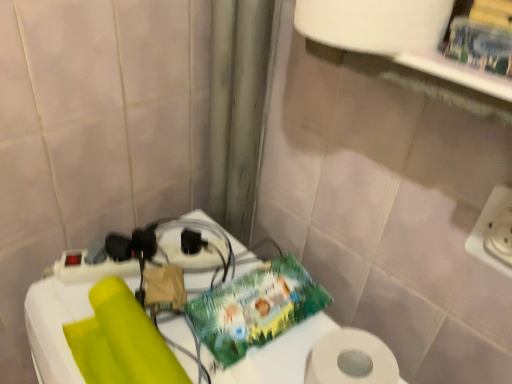
Question: Is white plastic table at lower left facing towards white plastic electric outlet at right?

Choices:
 (A) no
 (B) yes

Answer: (A)

Question: Is white plastic table at lower left at the left side of white plastic electric outlet at right?

Choices:
 (A) yes
 (B) no

Answer: (A)

Question: Is white plastic table at lower left outside of white plastic electric outlet at right?

Choices:
 (A) yes
 (B) no

Answer: (A)

Question: Is white plastic electric outlet at right completely or partially inside white plastic table at lower left?

Choices:
 (A) no
 (B) yes

Answer: (A)

Question: Can you confirm if white plastic table at lower left is smaller than white plastic electric outlet at right?

Choices:
 (A) yes
 (B) no

Answer: (B)

Question: From the image's perspective, is white plastic table at lower left on top of white plastic electric outlet at right?

Choices:
 (A) yes
 (B) no

Answer: (B)

Question: Is white plastic electric outlet at right not within white plastic table at lower left?

Choices:
 (A) yes
 (B) no

Answer: (A)

Question: Does white plastic electric outlet at right have a greater height compared to white plastic table at lower left?

Choices:
 (A) no
 (B) yes

Answer: (A)

Question: Is white plastic electric outlet at right looking in the opposite direction of white plastic table at lower left?

Choices:
 (A) no
 (B) yes

Answer: (A)

Question: From the image's perspective, is white plastic electric outlet at right located above white plastic table at lower left?

Choices:
 (A) no
 (B) yes

Answer: (B)

Question: Can you confirm if white plastic electric outlet at right is positioned to the left of white plastic table at lower left?

Choices:
 (A) yes
 (B) no

Answer: (B)

Question: Considering the relative sizes of white plastic electric outlet at right and white plastic table at lower left in the image provided, is white plastic electric outlet at right bigger than white plastic table at lower left?

Choices:
 (A) yes
 (B) no

Answer: (B)

Question: Is white plastic table at lower left positioned before black plastic socket at center?

Choices:
 (A) yes
 (B) no

Answer: (A)